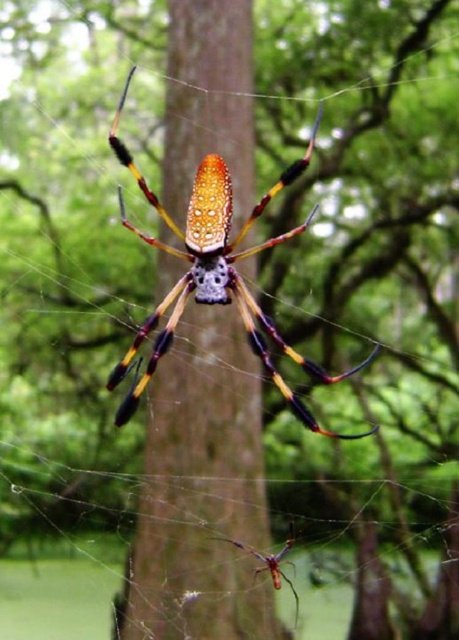
Question: Based on their relative distances, which object is nearer to the shiny metallic spider at center?

Choices:
 (A) brown wood tree trunk at center
 (B) orange fuzzy spider at center

Answer: (A)

Question: Which point is farther to the camera?

Choices:
 (A) orange fuzzy spider at center
 (B) brown wood tree trunk at center
 (C) shiny metallic spider at center

Answer: (B)

Question: Can you confirm if brown wood tree trunk at center is smaller than orange fuzzy spider at center?

Choices:
 (A) yes
 (B) no

Answer: (B)

Question: Which point is closer to the camera?

Choices:
 (A) shiny metallic spider at center
 (B) brown wood tree trunk at center

Answer: (A)

Question: Is shiny metallic spider at center bigger than orange fuzzy spider at center?

Choices:
 (A) no
 (B) yes

Answer: (B)

Question: Can you confirm if brown wood tree trunk at center is positioned above orange fuzzy spider at center?

Choices:
 (A) no
 (B) yes

Answer: (B)